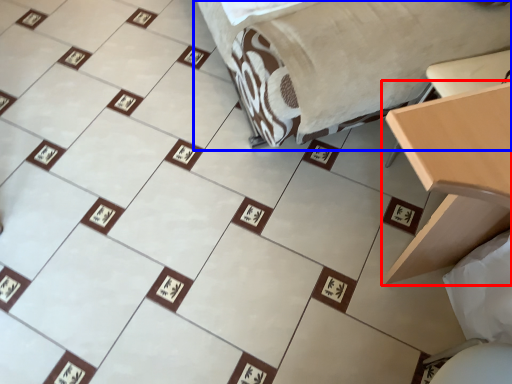
Question: Which of the following is the farthest to the observer, table (highlighted by a red box) or furniture (highlighted by a blue box)?

Choices:
 (A) table
 (B) furniture

Answer: (B)